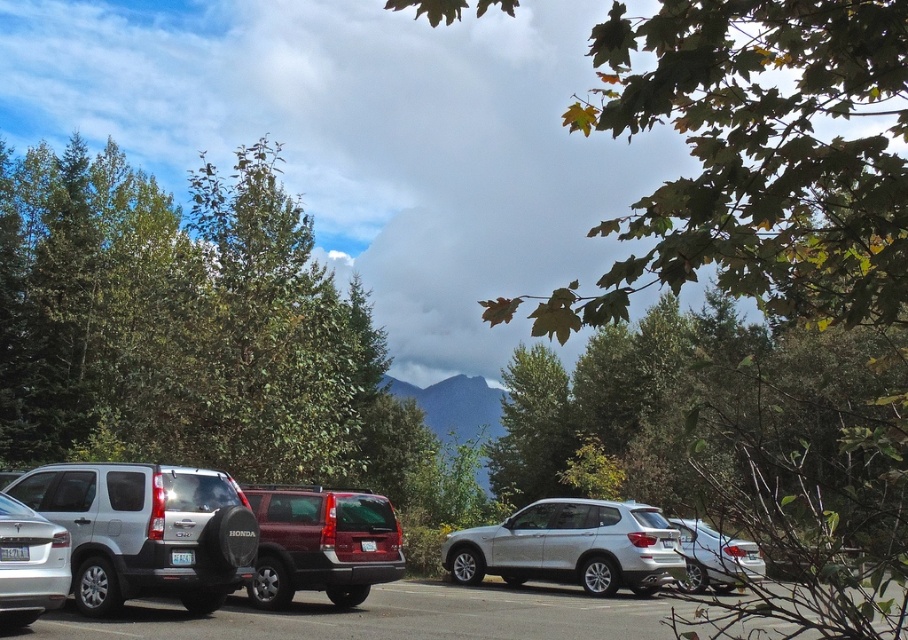
You are standing in the parking lot and want to take a photo of the satin silver car at center and the matte red suv at center. Which one should you point your camera at first if you want to capture them both in one frame without moving your position?

You should point your camera at the satin silver car at center first because it is closer to you than the matte red suv at center, allowing both to be in the same frame without needing to adjust your position.

You are a delivery person needing to park your van, which is 6 meters long, in this parking lot. The parking spot you want to use has the silver metallic suv at center and the satin silver sedan at center parked adjacent to it. Can your van fit in the remaining space between them?

The silver metallic suv at center is bigger than the satin silver sedan at center. Since the SUV is larger, the space between them might be sufficient for your 6m van. However, without exact measurements, it is uncertain. Check the available space carefully before proceeding.